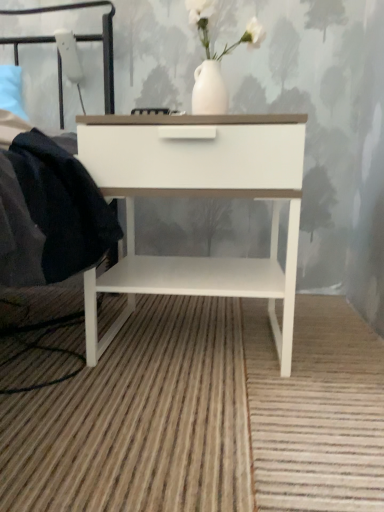
Find the location of a particular element. vacant space to the right of white glossy nightstand at center is located at coordinates (332, 342).